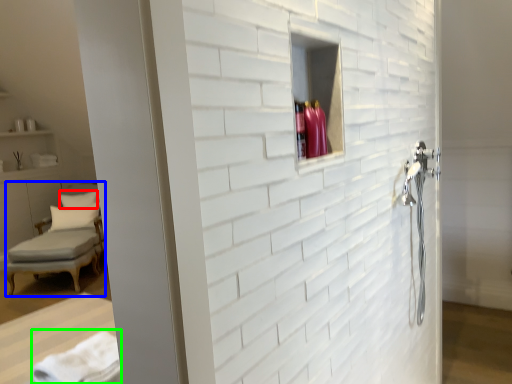
Question: Considering the real-world distances, which object is closest to pillow (highlighted by a red box)? chair (highlighted by a blue box) or bath towel (highlighted by a green box).

Choices:
 (A) chair
 (B) bath towel

Answer: (A)